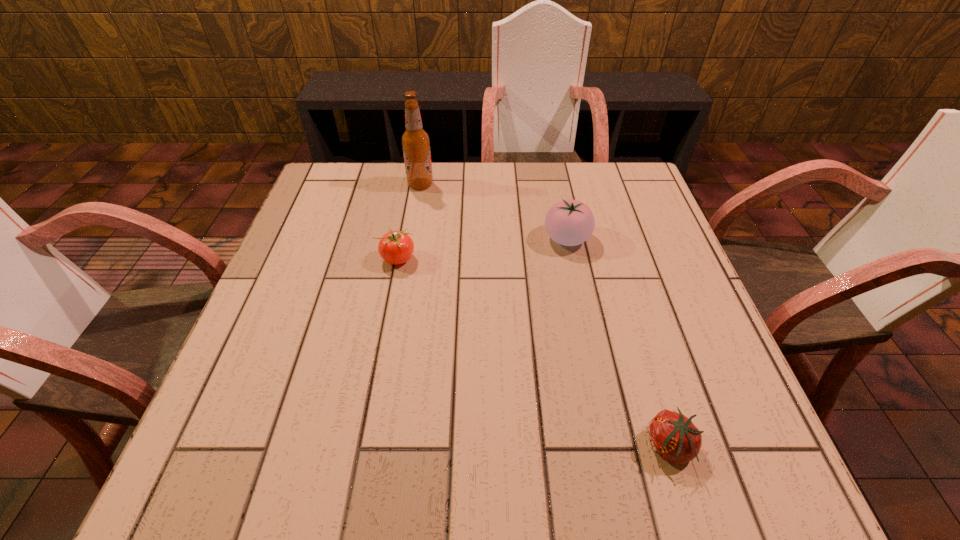
What are the coordinates of `the tallest object` in the screenshot? It's located at (415, 141).

Identify the location of the farthest object. (415, 141).

What are the coordinates of `the tallest tomato` in the screenshot? It's located at (569, 222).

At what (x,y) coordinates should I click in order to perform the action: click on the leftmost tomato. Please return your answer as a coordinate pair (x, y). This screenshot has height=540, width=960. Looking at the image, I should click on (395, 247).

The height and width of the screenshot is (540, 960). Identify the location of the nearest tomato. (673, 436).

This screenshot has height=540, width=960. What are the coordinates of `the shortest tomato` in the screenshot? It's located at (673, 436).

Where is `blank area located on the front label of the tallest object`? The width and height of the screenshot is (960, 540). blank area located on the front label of the tallest object is located at coordinates (469, 185).

You are a GUI agent. You are given a task and a screenshot of the screen. Output one action in this format:
    pyautogui.click(x=<x>, y=<y>)
    Task: Click on the vacant space positioned 0.110m on the right of the third shortest object
    The height and width of the screenshot is (540, 960).
    Given the screenshot: What is the action you would take?
    pyautogui.click(x=636, y=239)

The height and width of the screenshot is (540, 960). In order to click on free space located on the left of the leftmost tomato in this screenshot , I will do `click(328, 259)`.

I want to click on free space located 0.070m on the left of the nearest object, so coord(602,447).